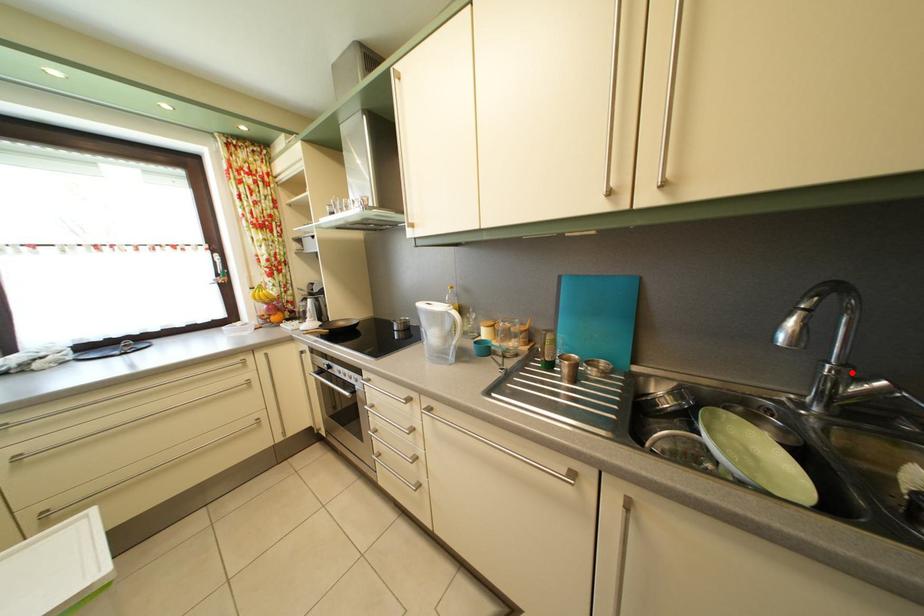
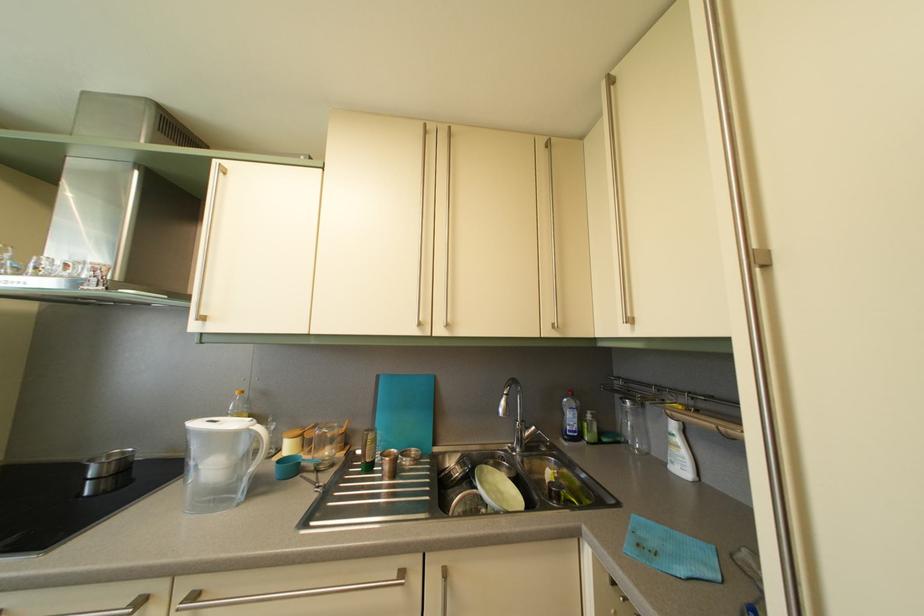
Locate, in the second image, the point that corresponds to the highlighted location in the first image.

(530, 429)